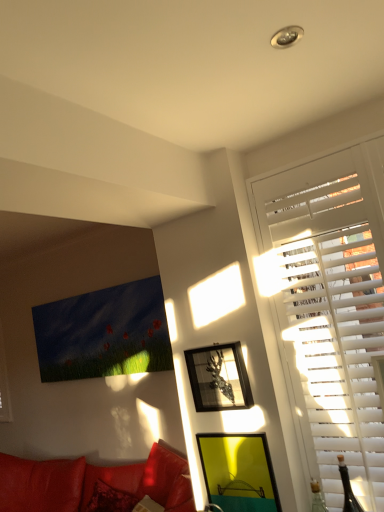
Question: Would you consider yellow matte picture frame at lower center, the second picture frame when ordered from top to bottom, to be distant from metallic silver picture frame at upper right, which is counted as the second picture frame, starting from the bottom?

Choices:
 (A) no
 (B) yes

Answer: (A)

Question: Does yellow matte picture frame at lower center, the first picture frame from the bottom, appear on the right side of metallic silver picture frame at upper right, which is counted as the second picture frame, starting from the bottom?

Choices:
 (A) yes
 (B) no

Answer: (A)

Question: From the image's perspective, is yellow matte picture frame at lower center, the second picture frame when ordered from top to bottom, under metallic silver picture frame at upper right, the first picture frame viewed from the top?

Choices:
 (A) yes
 (B) no

Answer: (A)

Question: Is the position of yellow matte picture frame at lower center, the first picture frame from the bottom, more distant than that of metallic silver picture frame at upper right, which is counted as the second picture frame, starting from the bottom?

Choices:
 (A) no
 (B) yes

Answer: (A)

Question: Can you confirm if yellow matte picture frame at lower center, the second picture frame when ordered from top to bottom, is smaller than metallic silver picture frame at upper right, which is counted as the second picture frame, starting from the bottom?

Choices:
 (A) no
 (B) yes

Answer: (B)

Question: Is yellow matte picture frame at lower center, the first picture frame from the bottom, wider or thinner than white wood blinds at right?

Choices:
 (A) wide
 (B) thin

Answer: (B)

Question: From a real-world perspective, is yellow matte picture frame at lower center, the second picture frame when ordered from top to bottom, positioned above or below white wood blinds at right?

Choices:
 (A) above
 (B) below

Answer: (B)

Question: Is yellow matte picture frame at lower center, the second picture frame when ordered from top to bottom, taller or shorter than white wood blinds at right?

Choices:
 (A) short
 (B) tall

Answer: (A)

Question: Is point (238, 473) positioned closer to the camera than point (311, 364)?

Choices:
 (A) farther
 (B) closer

Answer: (A)

Question: Is point (211, 458) positioned closer to the camera than point (31, 493)?

Choices:
 (A) farther
 (B) closer

Answer: (B)

Question: In terms of height, does yellow matte picture frame at lower center, the second picture frame when ordered from top to bottom, look taller or shorter compared to leather couch at lower left?

Choices:
 (A) short
 (B) tall

Answer: (A)

Question: From the image's perspective, is yellow matte picture frame at lower center, the second picture frame when ordered from top to bottom, located above or below leather couch at lower left?

Choices:
 (A) below
 (B) above

Answer: (B)

Question: Looking at the image, does yellow matte picture frame at lower center, the second picture frame when ordered from top to bottom, seem bigger or smaller compared to leather couch at lower left?

Choices:
 (A) big
 (B) small

Answer: (B)

Question: From the image's perspective, is leather couch at lower left located above or below metallic silver picture frame at upper right, which is counted as the second picture frame, starting from the bottom?

Choices:
 (A) above
 (B) below

Answer: (B)

Question: In terms of height, does leather couch at lower left look taller or shorter compared to metallic silver picture frame at upper right, which is counted as the second picture frame, starting from the bottom?

Choices:
 (A) tall
 (B) short

Answer: (A)